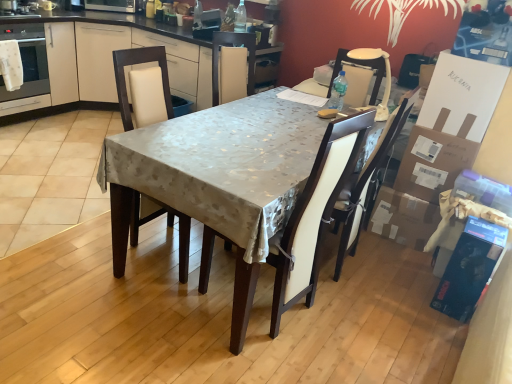
Question: From the image's perspective, is satin silver microwave at upper center positioned above or below matte white chair at center, placed as the third chair when sorted from right to left?

Choices:
 (A) above
 (B) below

Answer: (A)

Question: Considering the positions of point (116, 1) and point (164, 91), is point (116, 1) closer or farther from the camera than point (164, 91)?

Choices:
 (A) closer
 (B) farther

Answer: (B)

Question: Estimate the real-world distances between objects in this image. Which object is farther from the matte white chair at center, which appears as the first chair when viewed from the left?

Choices:
 (A) satin silver microwave at upper center
 (B) cardboard box at right, which is counted as the first cardboard box, starting from the top
 (C) beige fabric chair at upper right, the 3th chair positioned from the left
 (D) brown cardboard box at lower right, the 1th cardboard box ordered from the bottom
 (E) matte white oven at left

Answer: (A)

Question: Based on their relative distances, which object is farther from the cardboard box at right, which is counted as the first cardboard box, starting from the top?

Choices:
 (A) matte white chair at center, placed as the third chair when sorted from right to left
 (B) matte white oven at left
 (C) beige fabric chair at upper right, arranged as the 1th chair when viewed from the right
 (D) satin silver microwave at upper center
 (E) brown cardboard box at lower right, marked as the second cardboard box in a top-to-bottom arrangement

Answer: (B)